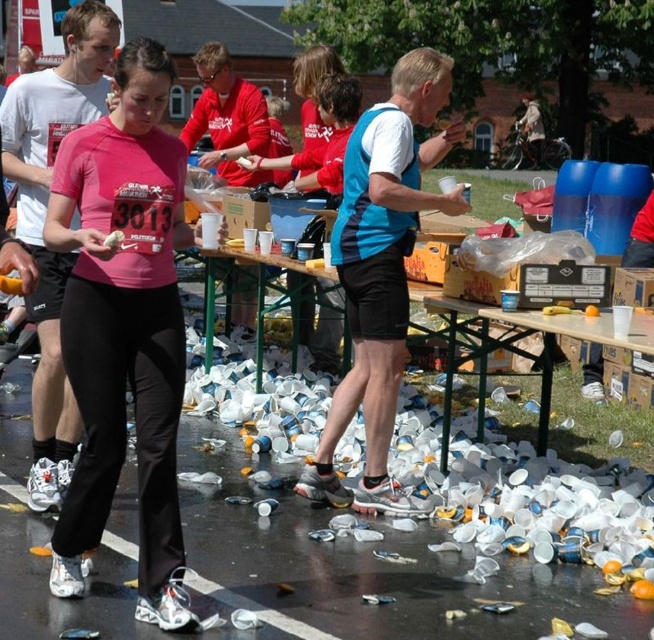
Question: Considering the real-world distances, which object is farthest from the white plastic table at center?

Choices:
 (A) white plastic cups at center
 (B) white plastic cup at center
 (C) pink matte shirt at center

Answer: (B)

Question: In this image, where is white plastic table at center located relative to white plastic cup at center?

Choices:
 (A) left
 (B) right

Answer: (B)

Question: Can you confirm if pink matte shirt at center is positioned to the left of white plastic cups at center?

Choices:
 (A) no
 (B) yes

Answer: (B)

Question: Which of these objects is positioned closest to the pink matte shirt at center?

Choices:
 (A) white plastic cups at center
 (B) white plastic table at center
 (C) white plastic cup at center

Answer: (C)

Question: Considering the real-world distances, which object is closest to the pink matte shirt at center?

Choices:
 (A) white plastic table at center
 (B) white plastic cup at center
 (C) white plastic cups at center

Answer: (B)

Question: Does white plastic cups at center have a smaller size compared to white plastic cup at center?

Choices:
 (A) yes
 (B) no

Answer: (B)